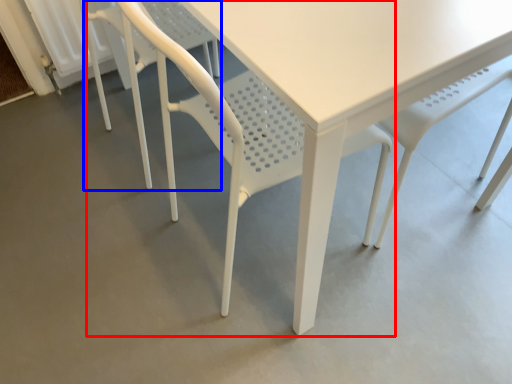
Question: Which object is closer to the camera taking this photo, chair (highlighted by a red box) or chair (highlighted by a blue box)?

Choices:
 (A) chair
 (B) chair

Answer: (A)